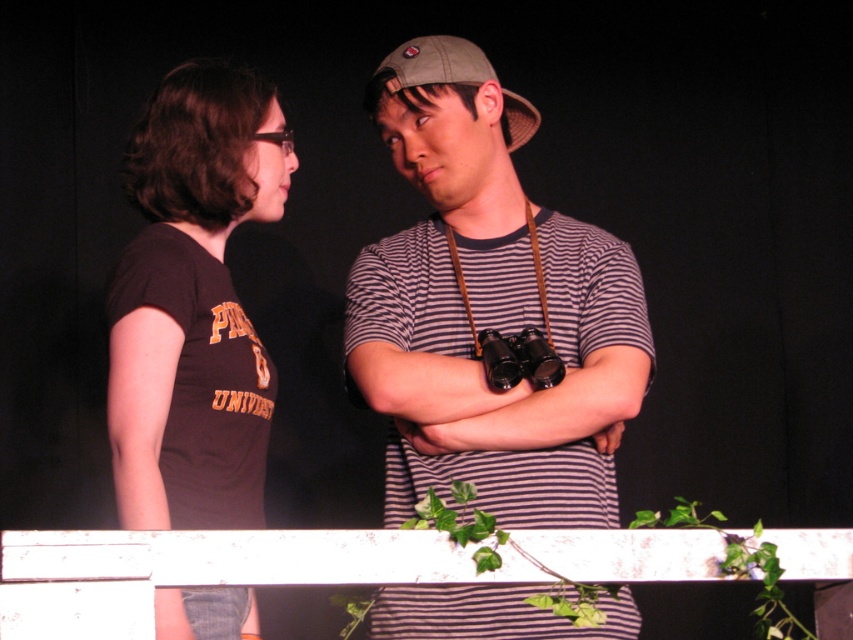
Question: Which point appears farthest from the camera in this image?

Choices:
 (A) (x=473, y=326)
 (B) (x=283, y=134)
 (C) (x=494, y=580)

Answer: (B)

Question: Among these objects, which one is farthest from the camera?

Choices:
 (A) white painted wood at center
 (B) brown cotton t-shirt at left
 (C) khaki fabric baseball cap at center
 (D) striped fabric binoculars at center

Answer: (C)

Question: Can you confirm if brown cotton t-shirt at left is bigger than white painted wood at center?

Choices:
 (A) no
 (B) yes

Answer: (B)

Question: Can you confirm if white painted wood at center is thinner than khaki fabric baseball cap at center?

Choices:
 (A) no
 (B) yes

Answer: (A)

Question: Does striped fabric binoculars at center have a smaller size compared to white painted wood at center?

Choices:
 (A) yes
 (B) no

Answer: (B)

Question: Which is nearer to the brown cotton t-shirt at left?

Choices:
 (A) khaki fabric baseball cap at center
 (B) striped fabric binoculars at center
 (C) white painted wood at center

Answer: (B)